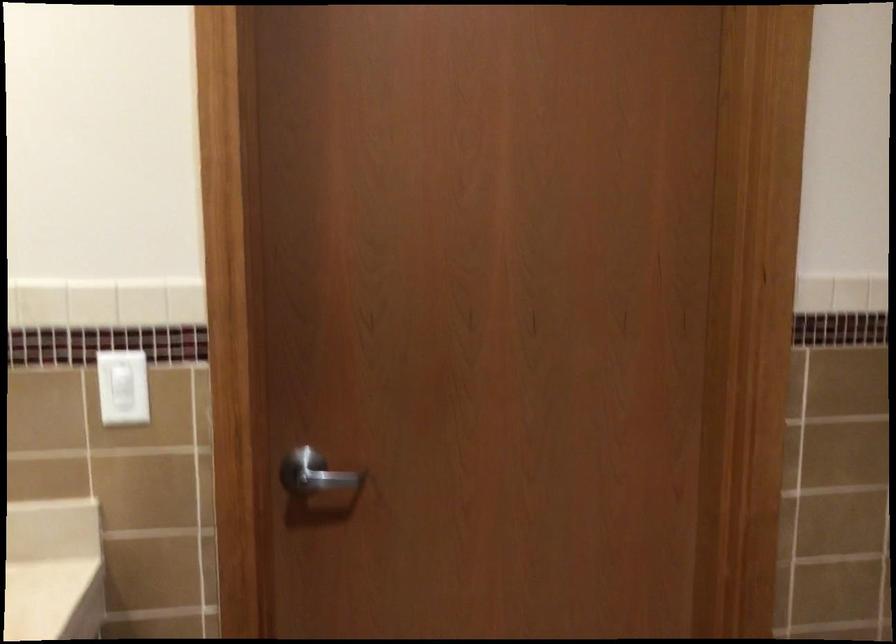
Question: The camera is either moving clockwise (left) or counter-clockwise (right) around the object. The first image is from the beginning of the video and the second image is from the end. Is the camera moving left or right when shooting the video?

Choices:
 (A) Left
 (B) Right

Answer: (A)